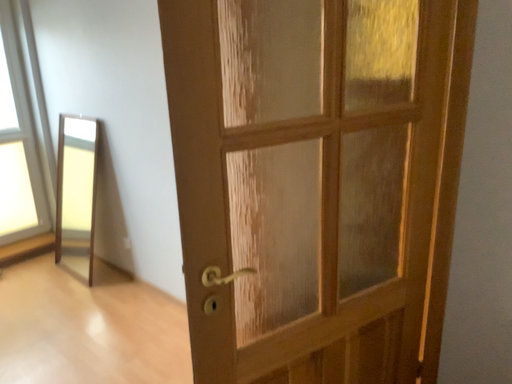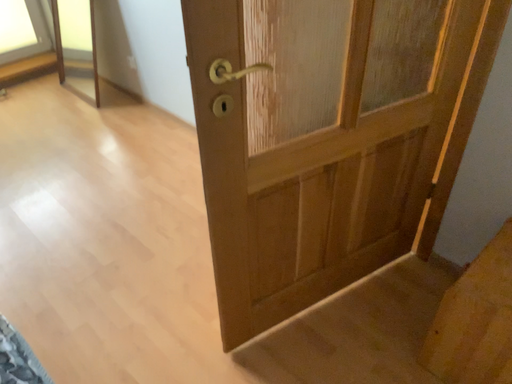
Question: How did the camera likely rotate when shooting the video?

Choices:
 (A) rotated downward
 (B) rotated upward

Answer: (A)